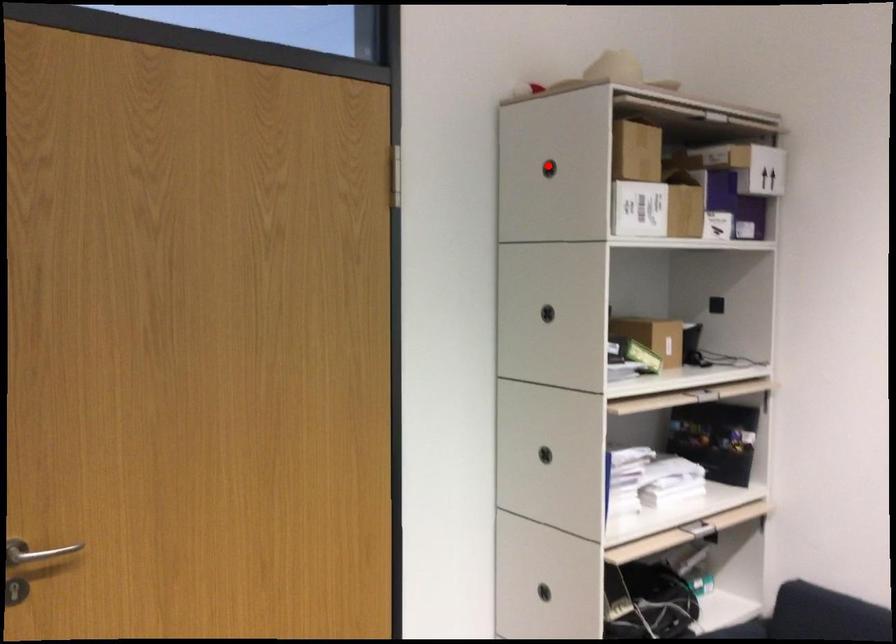
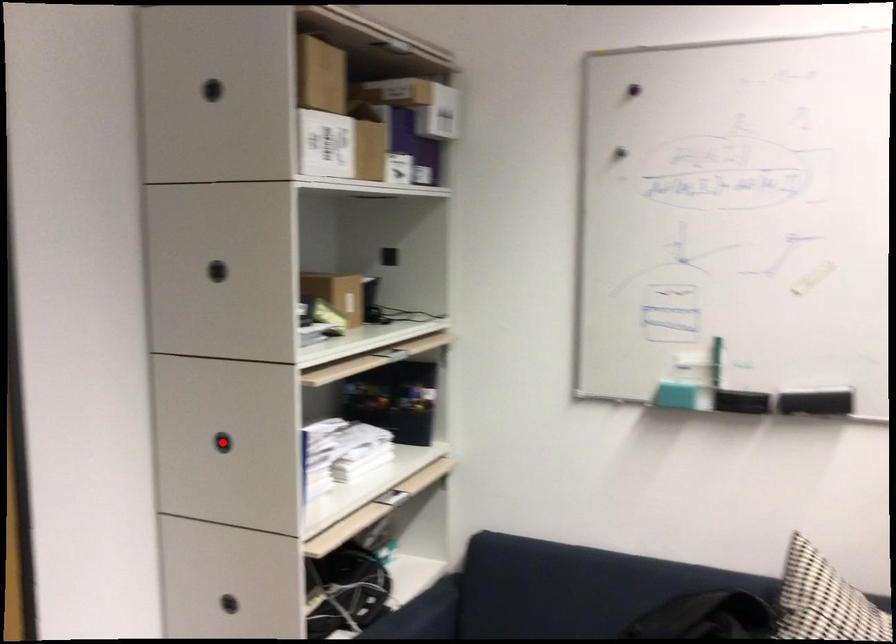
I am providing you with two images of the same scene from different viewpoints. A red point is marked on the first image and another point is marked on the second image. Does the point marked in image1 correspond to the same location as the one in image2?

No